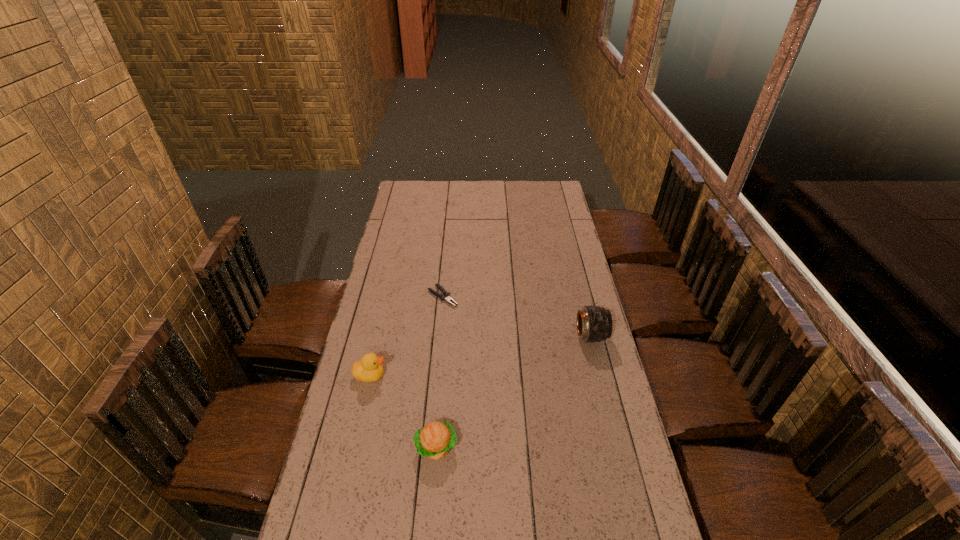
I want to click on the nearest object, so click(x=434, y=440).

The image size is (960, 540). I want to click on telephoto lens, so click(594, 324).

Identify the location of the rightmost object. pos(594,324).

The height and width of the screenshot is (540, 960). In order to click on the farthest object in this screenshot , I will do `click(447, 297)`.

Locate an element on the screen. The image size is (960, 540). the shortest object is located at coordinates (447, 297).

I want to click on duckling, so click(369, 369).

Locate an element on the screen. the second nearest object is located at coordinates (369, 369).

This screenshot has height=540, width=960. Identify the location of vacant region located 0.360m on the back of the nearest object. (444, 340).

Find the location of a particular element. The image size is (960, 540). free space located 0.310m at the gripping part of the pliers is located at coordinates (509, 348).

At what (x,y) coordinates should I click in order to perform the action: click on vacant region located 0.260m at the gripping part of the pliers. Please return your answer as a coordinate pair (x, y). Looking at the image, I should click on (499, 341).